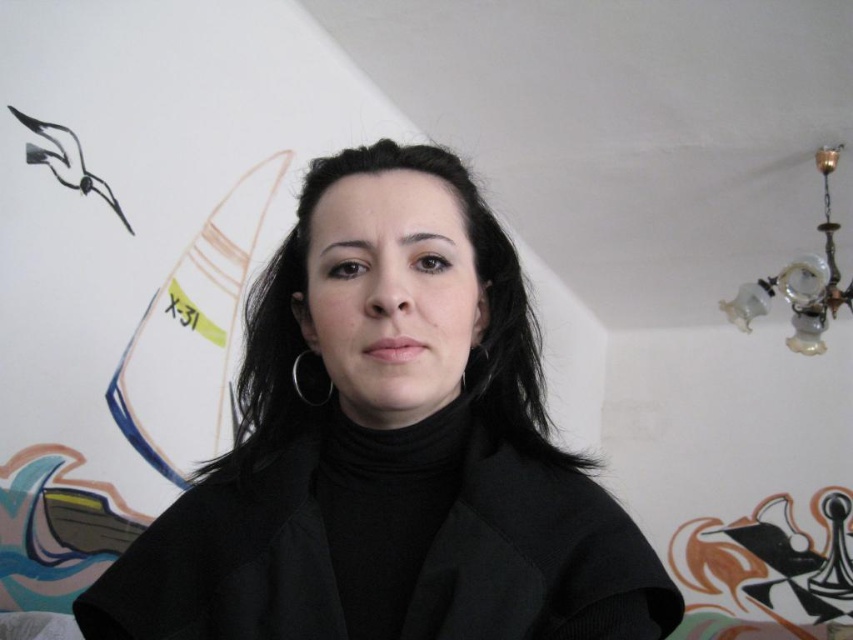
Does point (358, 397) lie behind point (517, 484)?

No, (358, 397) is in front of (517, 484).

What do you see at coordinates (389, 449) in the screenshot? Image resolution: width=853 pixels, height=640 pixels. I see `black matte jacket at center` at bounding box center [389, 449].

Identify the location of black matte jacket at center. (389, 449).